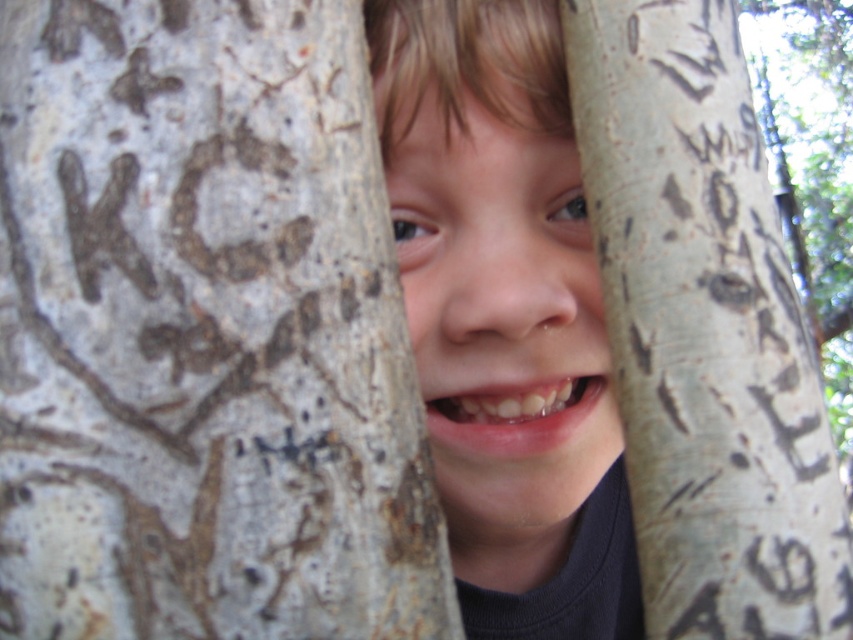
Question: Can you confirm if white bark tree trunk at center is positioned below light gray bark tree at center?

Choices:
 (A) yes
 (B) no

Answer: (A)

Question: Which of the following is the farthest from the observer?

Choices:
 (A) (412, 200)
 (B) (317, 273)

Answer: (A)

Question: Is light gray bark tree at center to the left of smooth skin face at center from the viewer's perspective?

Choices:
 (A) no
 (B) yes

Answer: (A)

Question: Estimate the real-world distances between objects in this image. Which object is closer to the light gray bark tree at center?

Choices:
 (A) smooth skin face at center
 (B) white bark tree trunk at center

Answer: (A)

Question: Which point is farther to the camera?

Choices:
 (A) white bark tree trunk at center
 (B) light gray bark tree at center

Answer: (B)

Question: Is white bark tree trunk at center to the right of smooth skin face at center from the viewer's perspective?

Choices:
 (A) no
 (B) yes

Answer: (A)